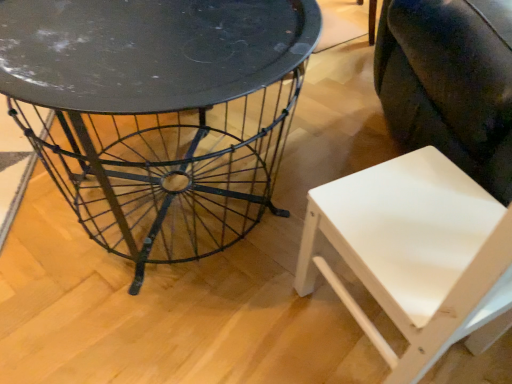
The height and width of the screenshot is (384, 512). I want to click on vacant space situated on the left part of white matte chair at lower right, so click(x=265, y=343).